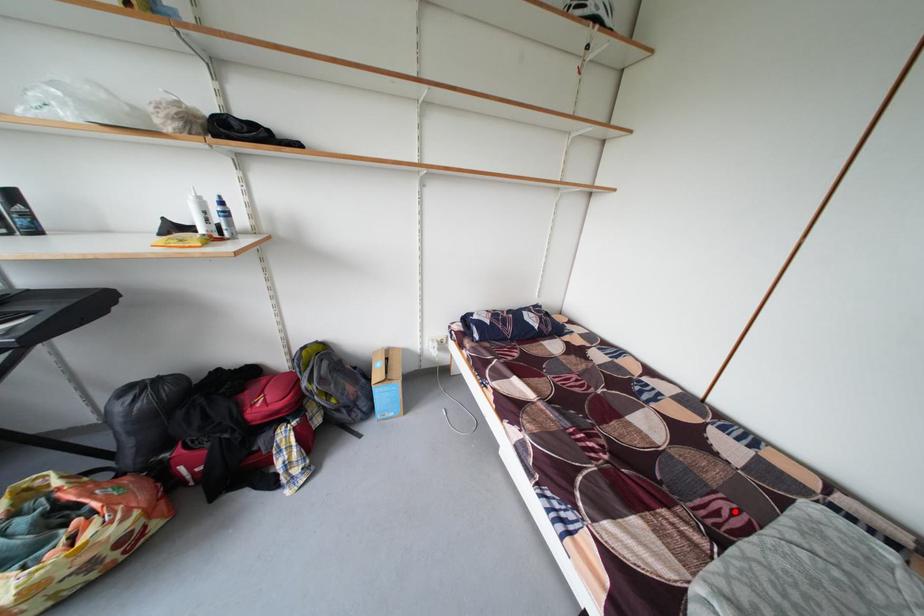
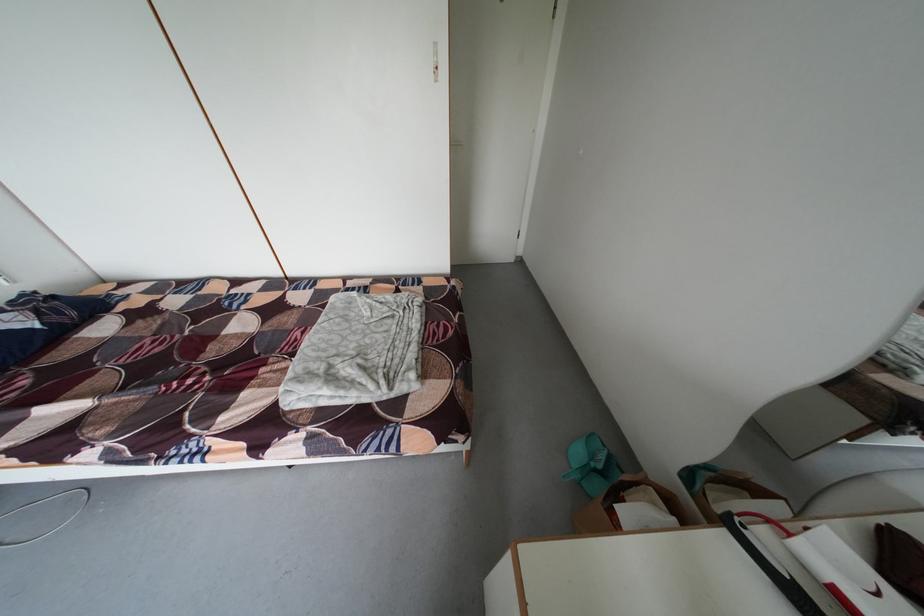
In the second image, find the point that corresponds to the highlighted location in the first image.

(309, 339)